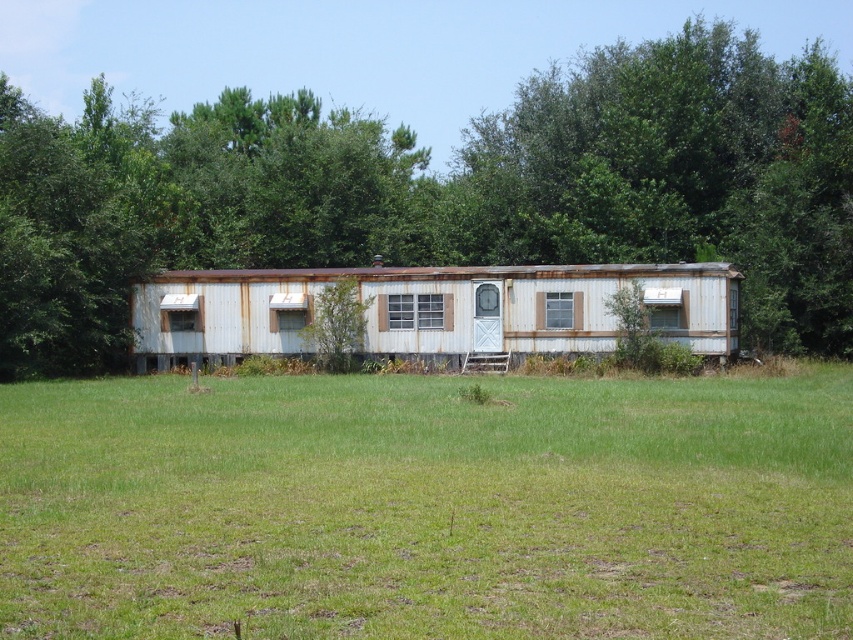
Question: Which object is positioned farthest from the rusty metal trailer at center?

Choices:
 (A) green grass at center
 (B) green leafy tree at center

Answer: (B)

Question: Which point is farther to the camera?

Choices:
 (A) rusty metal trailer at center
 (B) green leafy tree at center

Answer: (B)

Question: Is green grass at center behind green leafy tree at center?

Choices:
 (A) no
 (B) yes

Answer: (A)

Question: Does green grass at center appear over green leafy tree at center?

Choices:
 (A) yes
 (B) no

Answer: (B)

Question: Estimate the real-world distances between objects in this image. Which object is closer to the green leafy tree at center?

Choices:
 (A) rusty metal trailer at center
 (B) green grass at center

Answer: (A)

Question: Observing the image, what is the correct spatial positioning of green grass at center in reference to rusty metal trailer at center?

Choices:
 (A) right
 (B) left

Answer: (A)